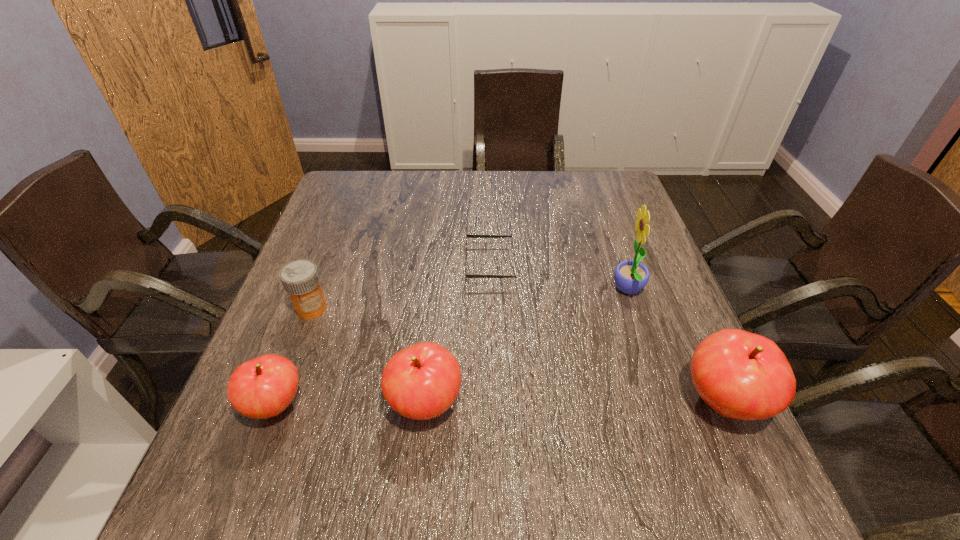
Where is `empty location between the shortest object and the second shortest apple`? Image resolution: width=960 pixels, height=540 pixels. empty location between the shortest object and the second shortest apple is located at coordinates (458, 334).

Find the location of `free space between the shortest apple and the rightmost apple`. free space between the shortest apple and the rightmost apple is located at coordinates (499, 403).

At what (x,y) coordinates should I click in order to perform the action: click on empty location between the third tallest object and the tallest object. Please return your answer as a coordinate pair (x, y). This screenshot has width=960, height=540. Looking at the image, I should click on (527, 347).

Locate an element on the screen. vacant region between the sunflower and the leftmost apple is located at coordinates (452, 348).

Where is `vacant region between the leftmost apple and the second tallest apple`? The width and height of the screenshot is (960, 540). vacant region between the leftmost apple and the second tallest apple is located at coordinates pos(350,404).

Find the location of a particular element. free space between the shortest apple and the tallest object is located at coordinates (452, 348).

In order to click on vacant area between the rightmost apple and the tallest object in this screenshot , I will do `click(676, 346)`.

You are a GUI agent. You are given a task and a screenshot of the screen. Output one action in this format:
    pyautogui.click(x=<x>, y=<y>)
    Task: Click on the vacant space that's between the medicine and the shortest object
    This screenshot has height=540, width=960.
    Given the screenshot: What is the action you would take?
    pyautogui.click(x=401, y=287)

The width and height of the screenshot is (960, 540). Identify the location of unoccupied position between the rightmost apple and the sunglasses. (607, 333).

The height and width of the screenshot is (540, 960). Find the location of `object identified as the closest to the third tallest object`. object identified as the closest to the third tallest object is located at coordinates (263, 387).